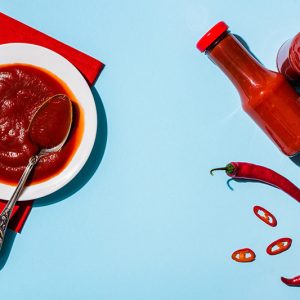
You are a GUI agent. You are given a task and a screenshot of the screen. Output one action in this format:
    pyautogui.click(x=<x>, y=<y>)
    Task: Click on the spoon
    The image size is (300, 300).
    Given the screenshot: What is the action you would take?
    pyautogui.click(x=32, y=166), pyautogui.click(x=10, y=207)